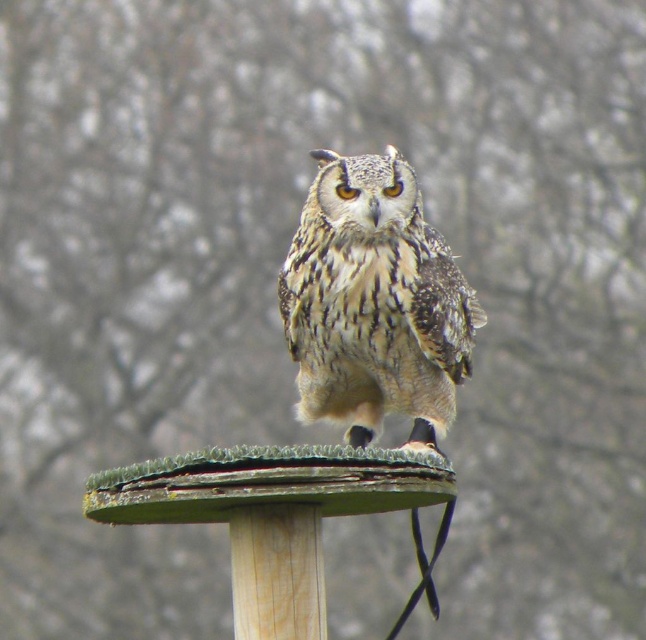
Question: Which point appears farthest from the camera in this image?

Choices:
 (A) (402, 365)
 (B) (242, 497)

Answer: (A)

Question: Is the position of speckled feathered owl at center more distant than that of green plastic bird feeder at center?

Choices:
 (A) yes
 (B) no

Answer: (A)

Question: Is speckled feathered owl at center further to camera compared to green plastic bird feeder at center?

Choices:
 (A) no
 (B) yes

Answer: (B)

Question: Among these points, which one is farthest from the camera?

Choices:
 (A) (324, 602)
 (B) (320, 328)

Answer: (B)

Question: Is speckled feathered owl at center wider than green plastic bird feeder at center?

Choices:
 (A) no
 (B) yes

Answer: (A)

Question: Which point is closer to the camera taking this photo?

Choices:
 (A) (412, 324)
 (B) (271, 561)

Answer: (B)